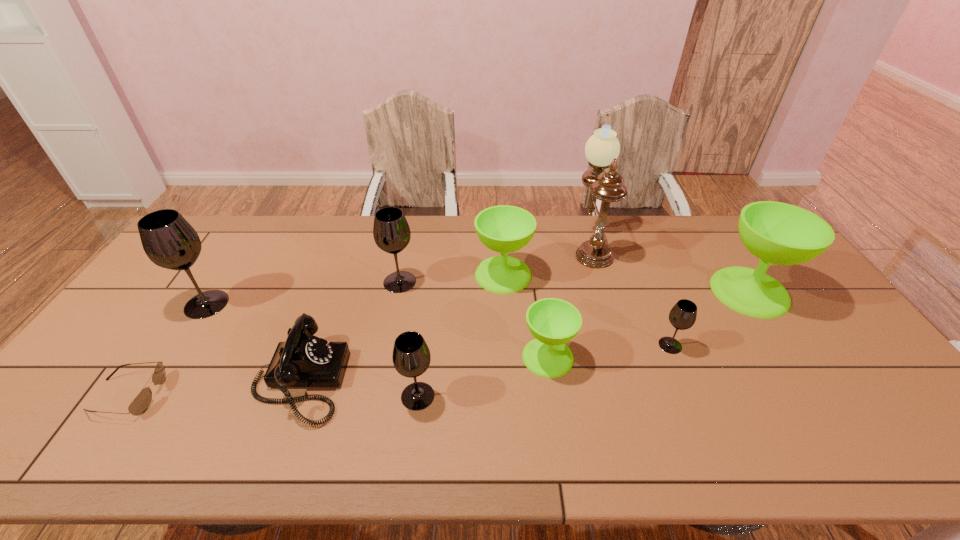
Image resolution: width=960 pixels, height=540 pixels. Identify the location of free space located 0.170m on the back of the biggest green wineglass. (713, 237).

Identify the location of vacant region located on the back of the second biggest green wineglass. The image size is (960, 540). (500, 226).

Locate an element on the screen. The width and height of the screenshot is (960, 540). vacant area situated on the left of the nearest wineglass is located at coordinates (348, 396).

Identify the location of vacant space located on the front of the second wineglass from right to left. Image resolution: width=960 pixels, height=540 pixels. (707, 435).

I want to click on free point located on the right of the nearest green wineglass, so click(x=648, y=357).

Image resolution: width=960 pixels, height=540 pixels. I want to click on vacant space situated on the dial of the third object from left to right, so click(399, 380).

Where is `free space located 0.370m on the front-facing side of the shortest object`? free space located 0.370m on the front-facing side of the shortest object is located at coordinates (310, 395).

At what (x,y) coordinates should I click in order to perform the action: click on object that is at the far edge. Please return your answer as a coordinate pair (x, y). The width and height of the screenshot is (960, 540). Looking at the image, I should click on click(x=602, y=149).

Where is `object that is at the near edge`? object that is at the near edge is located at coordinates (303, 360).

Find the location of `wineglass situated at the left edge`. wineglass situated at the left edge is located at coordinates (169, 241).